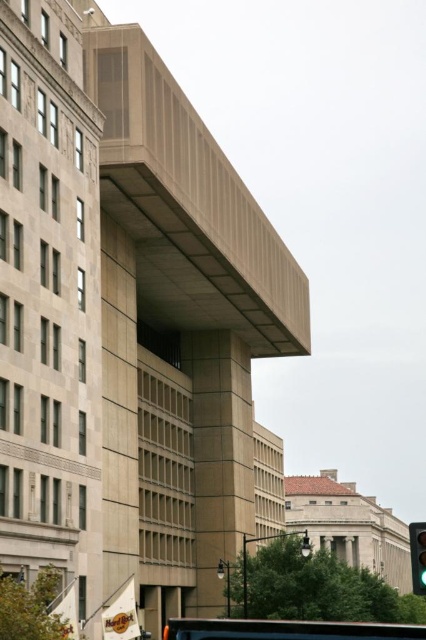
You are standing at the entrance of the large beige building with the overhang. You see the metallic silver bus at center. In which direction should you walk to reach the bus?

The metallic silver bus at center is located at point coordinates, so you should walk towards the center of the scene to reach it.

You are a pedestrian standing at the crosswalk near the green glass traffic light at lower right. You need to cross the street to reach the metallic silver bus at center. Is the bus visible from your current position?

The metallic silver bus at center is larger in size than the green glass traffic light at lower right, so yes, the bus is visible from your current position at the crosswalk near the green glass traffic light at lower right.